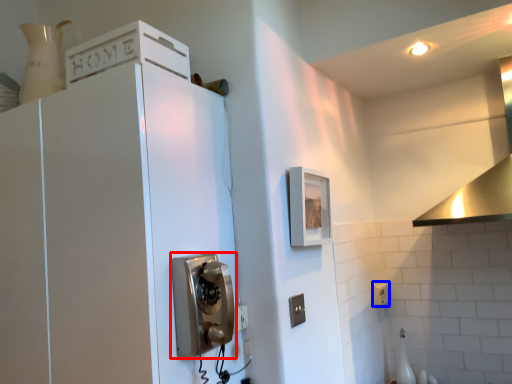
Question: Which of the following is the closest to the observer, corded phone (highlighted by a red box) or electric outlet (highlighted by a blue box)?

Choices:
 (A) corded phone
 (B) electric outlet

Answer: (A)